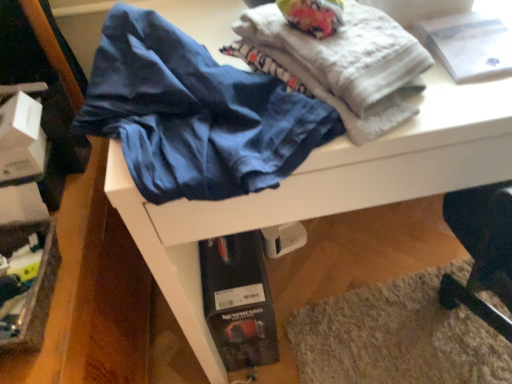
Question: Is the depth of white textured towel at upper center less than that of white paper at upper right?

Choices:
 (A) yes
 (B) no

Answer: (A)

Question: From a real-world perspective, is white textured towel at upper center below white paper at upper right?

Choices:
 (A) no
 (B) yes

Answer: (A)

Question: Can you confirm if white textured towel at upper center is smaller than white paper at upper right?

Choices:
 (A) no
 (B) yes

Answer: (A)

Question: Does white textured towel at upper center have a larger size compared to white paper at upper right?

Choices:
 (A) no
 (B) yes

Answer: (B)

Question: From the image's perspective, is white textured towel at upper center under white paper at upper right?

Choices:
 (A) yes
 (B) no

Answer: (A)

Question: Is white textured towel at upper center turned away from white paper at upper right?

Choices:
 (A) no
 (B) yes

Answer: (A)

Question: Is matte blue underwear at center closer to the viewer compared to white paper at upper right?

Choices:
 (A) no
 (B) yes

Answer: (B)

Question: From a real-world perspective, is matte blue underwear at center below white paper at upper right?

Choices:
 (A) no
 (B) yes

Answer: (A)

Question: From the image's perspective, would you say matte blue underwear at center is positioned over white paper at upper right?

Choices:
 (A) yes
 (B) no

Answer: (B)

Question: Is matte blue underwear at center outside white paper at upper right?

Choices:
 (A) no
 (B) yes

Answer: (B)

Question: Would you say matte blue underwear at center is a long distance from white paper at upper right?

Choices:
 (A) yes
 (B) no

Answer: (B)

Question: Does matte blue underwear at center lie behind white paper at upper right?

Choices:
 (A) no
 (B) yes

Answer: (A)

Question: Does white textured towel at upper center appear on the right side of matte blue underwear at center?

Choices:
 (A) no
 (B) yes

Answer: (B)